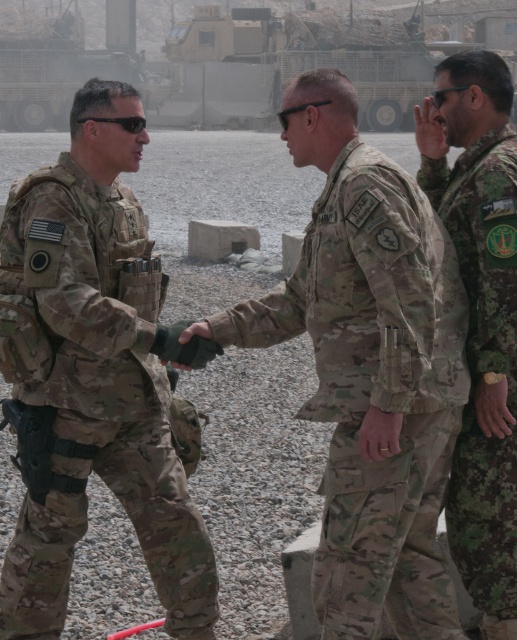
Which is behind, point (50, 186) or point (428, 436)?

The point (50, 186) is more distant.

Who is taller, camouflage uniform at center or camouflage fabric uniform at center?

Standing taller between the two is camouflage uniform at center.

Is point (83, 144) in front of point (457, 317)?

No, it is behind (457, 317).

What are the coordinates of `camouflage uniform at center` in the screenshot? It's located at (96, 380).

Who is shorter, camouflage uniform at center or camouflage fabric uniform at right?

With less height is camouflage fabric uniform at right.

Measure the distance from camouflage uniform at center to camouflage fabric uniform at right.

camouflage uniform at center is 38.53 inches from camouflage fabric uniform at right.

Does point (73, 216) lie behind point (488, 529)?

No, it is in front of (488, 529).

The width and height of the screenshot is (517, 640). Find the location of `camouflage uniform at center`. camouflage uniform at center is located at coordinates (96, 380).

Is camouflage fabric uniform at center wider than camouflage fabric uniform at right?

Yes, camouflage fabric uniform at center is wider than camouflage fabric uniform at right.

Does camouflage fabric uniform at center have a greater height compared to camouflage fabric uniform at right?

No.

Where is `camouflage fabric uniform at center`? camouflage fabric uniform at center is located at coordinates (374, 388).

This screenshot has width=517, height=640. I want to click on camouflage fabric uniform at center, so click(374, 388).